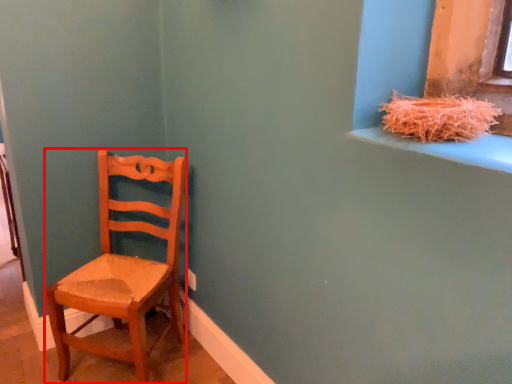
Question: From the image's perspective, what is the correct spatial relationship of chair (annotated by the red box) in relation to straw?

Choices:
 (A) below
 (B) above

Answer: (A)